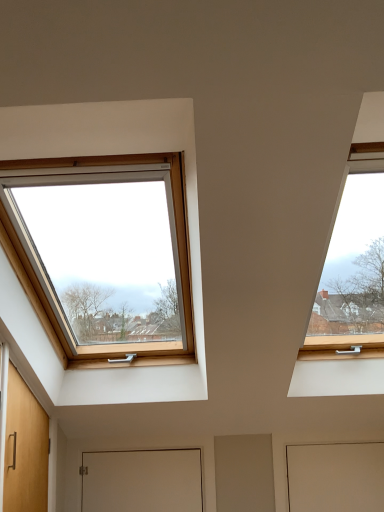
Question: Does white matte door at center, the 2th door when ordered from right to left, lie behind white matte door at lower right, the first door in the right-to-left sequence?

Choices:
 (A) yes
 (B) no

Answer: (A)

Question: Is white matte door at center, the 1th door in the left-to-right sequence, shorter than white matte door at lower right, the first door in the right-to-left sequence?

Choices:
 (A) yes
 (B) no

Answer: (A)

Question: Does white matte door at center, the 1th door in the left-to-right sequence, have a greater height compared to white matte door at lower right, the first door in the right-to-left sequence?

Choices:
 (A) yes
 (B) no

Answer: (B)

Question: Does white matte door at center, the 1th door in the left-to-right sequence, have a lesser width compared to white matte door at lower right, the 2th door from the left?

Choices:
 (A) yes
 (B) no

Answer: (A)

Question: Can you confirm if white matte door at center, the 2th door when ordered from right to left, is positioned to the left of white matte door at lower right, the 2th door from the left?

Choices:
 (A) yes
 (B) no

Answer: (A)

Question: Is white matte door at center, the 2th door when ordered from right to left, positioned with its back to white matte door at lower right, the 2th door from the left?

Choices:
 (A) yes
 (B) no

Answer: (B)

Question: Considering the relative sizes of white matte door at lower right, the first door in the right-to-left sequence, and white matte door at center, the 2th door when ordered from right to left, in the image provided, is white matte door at lower right, the first door in the right-to-left sequence, shorter than white matte door at center, the 2th door when ordered from right to left,?

Choices:
 (A) no
 (B) yes

Answer: (A)

Question: Considering the relative sizes of white matte door at lower right, the 2th door from the left, and white matte door at center, the 1th door in the left-to-right sequence, in the image provided, is white matte door at lower right, the 2th door from the left, bigger than white matte door at center, the 1th door in the left-to-right sequence,?

Choices:
 (A) no
 (B) yes

Answer: (A)

Question: Does white matte door at lower right, the first door in the right-to-left sequence, have a smaller size compared to white matte door at center, the 2th door when ordered from right to left?

Choices:
 (A) yes
 (B) no

Answer: (A)

Question: Can you confirm if white matte door at lower right, the 2th door from the left, is positioned to the left of white matte door at center, the 1th door in the left-to-right sequence?

Choices:
 (A) yes
 (B) no

Answer: (B)

Question: Is white matte door at lower right, the 2th door from the left, at the right side of white matte door at center, the 1th door in the left-to-right sequence?

Choices:
 (A) no
 (B) yes

Answer: (B)

Question: Considering the relative positions of white matte door at lower right, the first door in the right-to-left sequence, and white matte door at center, the 2th door when ordered from right to left, in the image provided, is white matte door at lower right, the first door in the right-to-left sequence, in front of white matte door at center, the 2th door when ordered from right to left,?

Choices:
 (A) yes
 (B) no

Answer: (A)

Question: In terms of width, does white matte door at center, the 2th door when ordered from right to left, look wider or thinner when compared to white matte door at lower right, the 2th door from the left?

Choices:
 (A) wide
 (B) thin

Answer: (B)